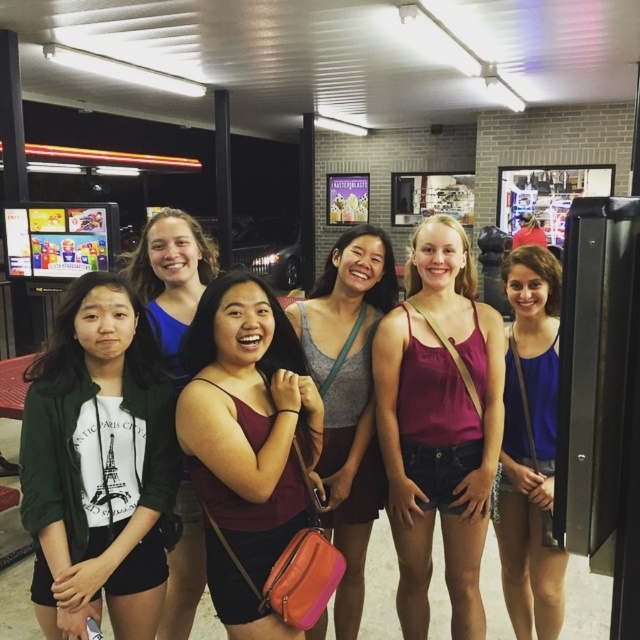
You are a photographer standing in front of the group of women. You want to take a photo that includes both the matte pink tank top at center and the matte red tank top at center. Given that your camera has a maximum focus range of 20 inches, will you be able to capture both in focus without moving closer?

The distance between the matte pink tank top at center and the matte red tank top at center is 23.07 inches, which exceeds the camera maximum focus range of 20 inches. Therefore, you will not be able to capture both in focus without moving closer.

You are a photographer trying to capture a photo of the matte red tank top at center and the white cotton shirt at left. Based on their positions, which one should you focus on first if you want to ensure both are in the frame without moving the camera?

The matte red tank top at center is taller than the white cotton shirt at left, so you should focus on the matte red tank top at center first to ensure both are in the frame without moving the camera.